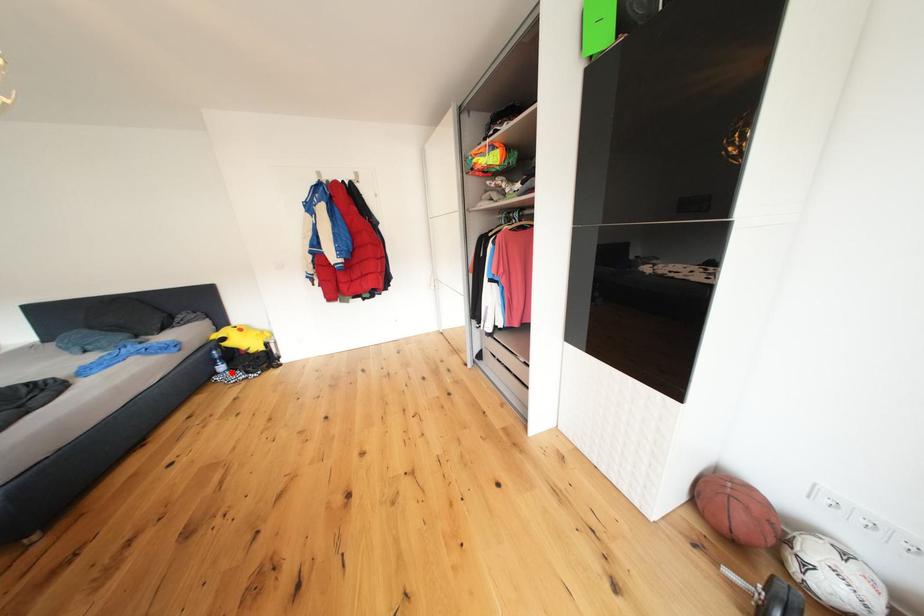
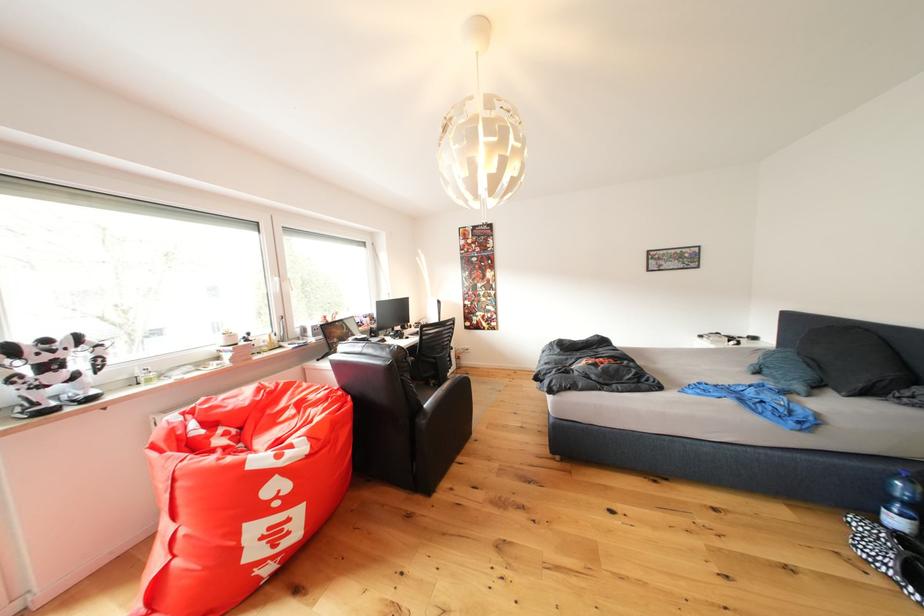
Question: I am providing you with two images of the same scene from different viewpoints. Image1 has a red point marked. In image2, the corresponding 3D location appears at what relative position? Reply with the corresponding letter.

Choices:
 (A) Closer
 (B) Farther

Answer: (B)